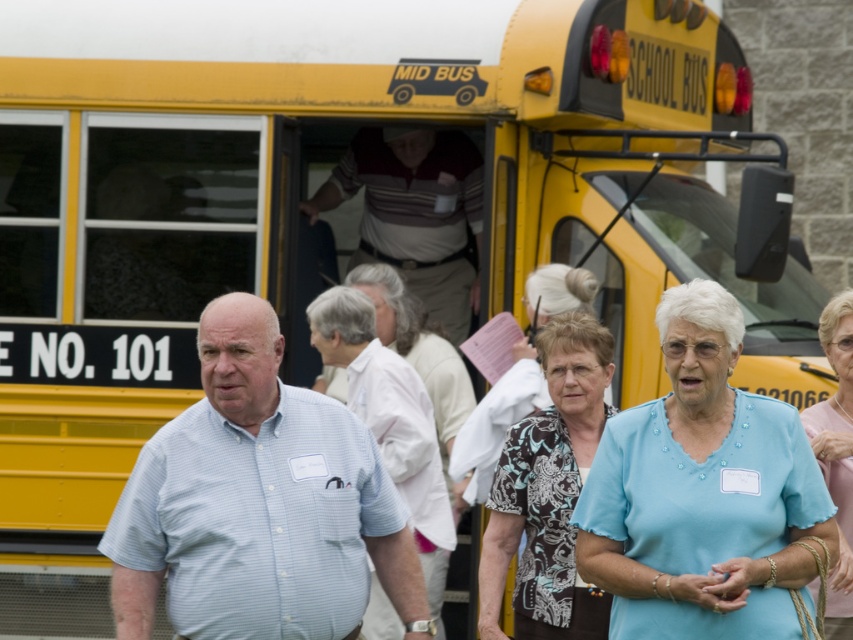
Question: Based on their relative distances, which object is nearer to the light blue shirt at center?

Choices:
 (A) striped polo shirt at center
 (B) light blue fabric at center
 (C) light blue striped shirt at center

Answer: (C)

Question: Is light blue fabric at center positioned before light blue shirt at center?

Choices:
 (A) no
 (B) yes

Answer: (B)

Question: Among these points, which one is nearest to the camera?

Choices:
 (A) (244, 336)
 (B) (329, 288)

Answer: (A)

Question: Which of these objects is positioned closest to the striped polo shirt at center?

Choices:
 (A) light blue fabric at center
 (B) light blue shirt at center
 (C) light blue striped shirt at center

Answer: (B)

Question: Does light blue fabric at center appear over light blue shirt at center?

Choices:
 (A) no
 (B) yes

Answer: (B)

Question: Is light blue striped shirt at center positioned before light blue shirt at center?

Choices:
 (A) no
 (B) yes

Answer: (B)